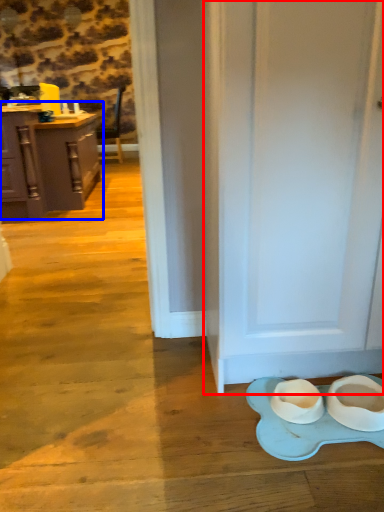
Question: Which of the following is the closest to the observer, door (highlighted by a red box) or cabinetry (highlighted by a blue box)?

Choices:
 (A) door
 (B) cabinetry

Answer: (A)